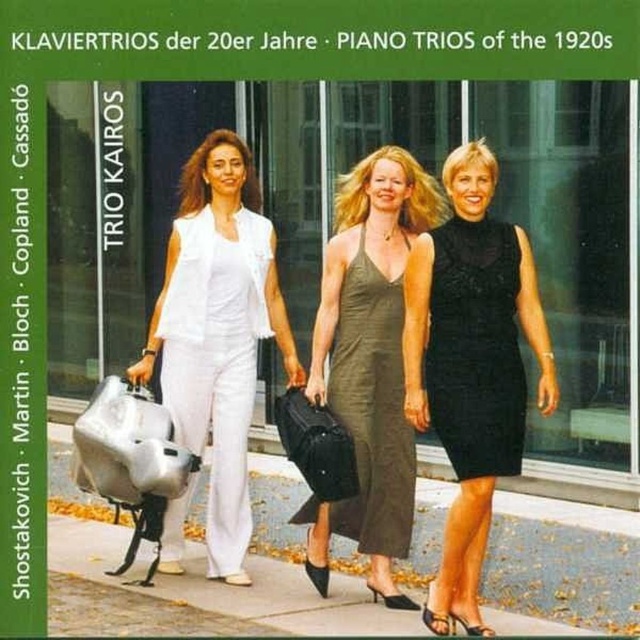
Who is more forward, (x=467, y=280) or (x=403, y=522)?

Point (x=467, y=280) is in front.

Is black lace dress at center closer to the viewer compared to matte olive green dress at center?

Yes, black lace dress at center is closer to the viewer.

Which is behind, point (484, 468) or point (362, 481)?

The point (362, 481) is more distant.

This screenshot has height=640, width=640. What are the coordinates of `black lace dress at center` in the screenshot? It's located at (472, 365).

Can you confirm if black lace dress at center is positioned below gray concrete pavement at center?

Incorrect, black lace dress at center is not positioned below gray concrete pavement at center.

Which is below, black lace dress at center or gray concrete pavement at center?

gray concrete pavement at center is lower down.

Does point (420, 364) lie in front of point (424, 550)?

That is True.

The image size is (640, 640). Identify the location of black lace dress at center. (472, 365).

Which is below, black lace dress at center or white matte vest at center?

black lace dress at center

Who is positioned more to the left, black lace dress at center or white matte vest at center?

white matte vest at center is more to the left.

Between point (486, 502) and point (234, 371), which one is positioned in front?

Point (486, 502)

Where is `black lace dress at center`? The height and width of the screenshot is (640, 640). black lace dress at center is located at coordinates (472, 365).